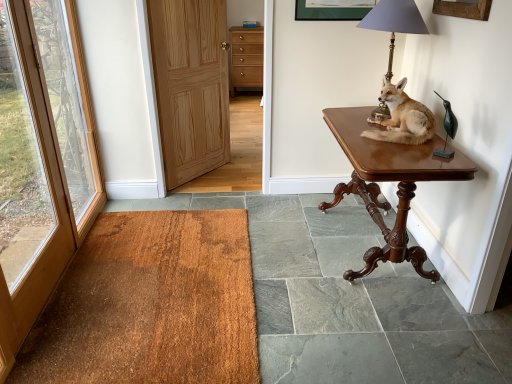
Where is `vacant region under brown wood table at right (from a real-world perspective)`? The width and height of the screenshot is (512, 384). vacant region under brown wood table at right (from a real-world perspective) is located at coordinates (366, 244).